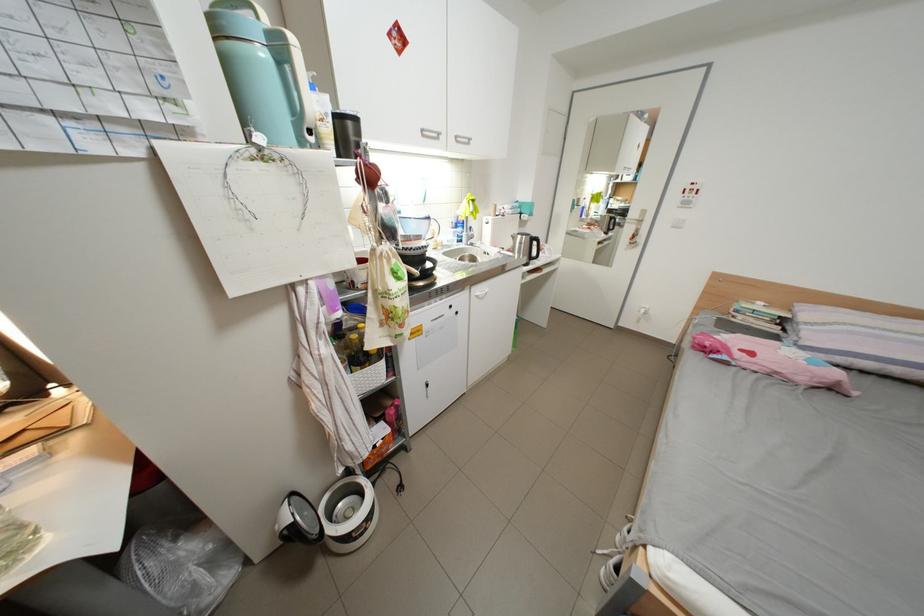
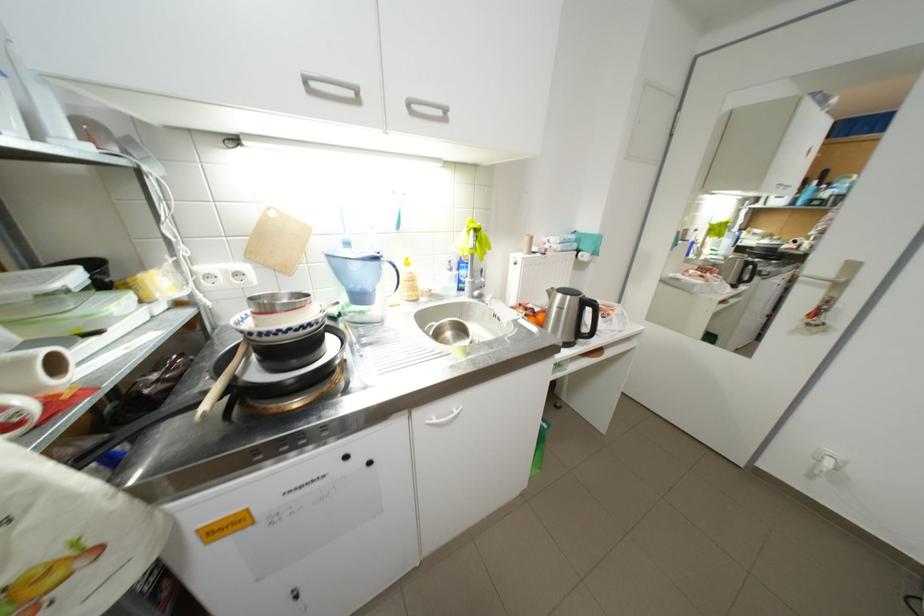
Where in the second image is the point corresponding to the point at 470,230 from the first image?

(475, 273)